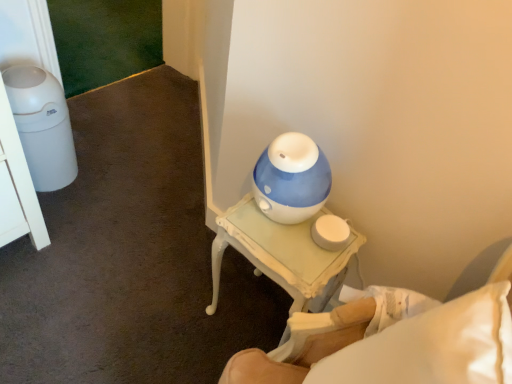
Question: Does white painted wood nightstand at lower right come behind white painted wood table at center?

Choices:
 (A) no
 (B) yes

Answer: (A)

Question: From the image's perspective, does white painted wood nightstand at lower right appear higher than white painted wood table at center?

Choices:
 (A) no
 (B) yes

Answer: (A)

Question: Is white painted wood nightstand at lower right thinner than white painted wood table at center?

Choices:
 (A) yes
 (B) no

Answer: (B)

Question: Is white painted wood nightstand at lower right placed right next to white painted wood table at center?

Choices:
 (A) no
 (B) yes

Answer: (A)

Question: From a real-world perspective, does white painted wood nightstand at lower right sit lower than white painted wood table at center?

Choices:
 (A) yes
 (B) no

Answer: (B)

Question: Considering the relative positions of white painted wood nightstand at lower right and white painted wood table at center in the image provided, is white painted wood nightstand at lower right in front of white painted wood table at center?

Choices:
 (A) no
 (B) yes

Answer: (B)

Question: From a real-world perspective, is white painted wood table at center physically below white painted wood nightstand at lower right?

Choices:
 (A) yes
 (B) no

Answer: (A)

Question: Is white painted wood table at center far away from white painted wood nightstand at lower right?

Choices:
 (A) no
 (B) yes

Answer: (A)

Question: Considering the relative sizes of white painted wood table at center and white painted wood nightstand at lower right in the image provided, is white painted wood table at center shorter than white painted wood nightstand at lower right?

Choices:
 (A) yes
 (B) no

Answer: (A)

Question: Considering the relative sizes of white painted wood table at center and white painted wood nightstand at lower right in the image provided, is white painted wood table at center thinner than white painted wood nightstand at lower right?

Choices:
 (A) yes
 (B) no

Answer: (A)

Question: Is white painted wood table at center smaller than white painted wood nightstand at lower right?

Choices:
 (A) no
 (B) yes

Answer: (B)

Question: From a real-world perspective, is white painted wood table at center on top of white painted wood nightstand at lower right?

Choices:
 (A) yes
 (B) no

Answer: (B)

Question: Considering their positions, is white painted wood table at center located in front of or behind white painted wood nightstand at lower right?

Choices:
 (A) behind
 (B) front

Answer: (A)